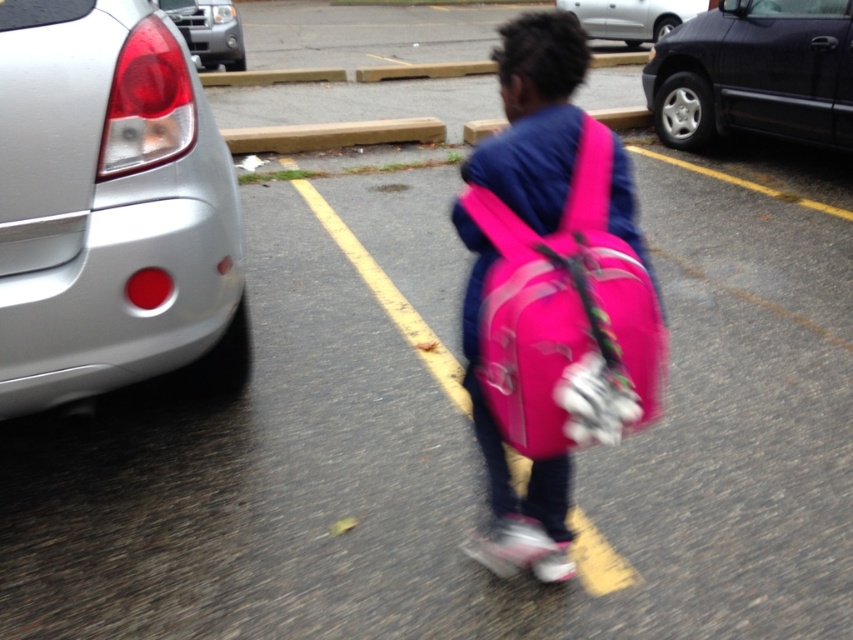
Measure the distance from silver metallic car at left to metallic silver truck at upper left.

silver metallic car at left is 8.57 meters from metallic silver truck at upper left.

Does silver metallic car at left appear on the right side of metallic silver truck at upper left?

Indeed, silver metallic car at left is positioned on the right side of metallic silver truck at upper left.

Is point (193, 264) in front of point (204, 22)?

Yes, point (193, 264) is in front of point (204, 22).

Image resolution: width=853 pixels, height=640 pixels. I want to click on silver metallic car at left, so click(x=108, y=204).

Does pink fabric backpack at center have a greater width compared to silver metallic car at upper center?

No, pink fabric backpack at center is not wider than silver metallic car at upper center.

Who is more forward, (640, 316) or (654, 33)?

Point (640, 316) is more forward.

This screenshot has width=853, height=640. I want to click on pink fabric backpack at center, so click(x=550, y=294).

Is point (91, 180) positioned in front of point (514, 180)?

No, it is not.

At what (x,y) coordinates should I click in order to perform the action: click on silver metallic car at left. Please return your answer as a coordinate pair (x, y). The width and height of the screenshot is (853, 640). Looking at the image, I should click on tap(108, 204).